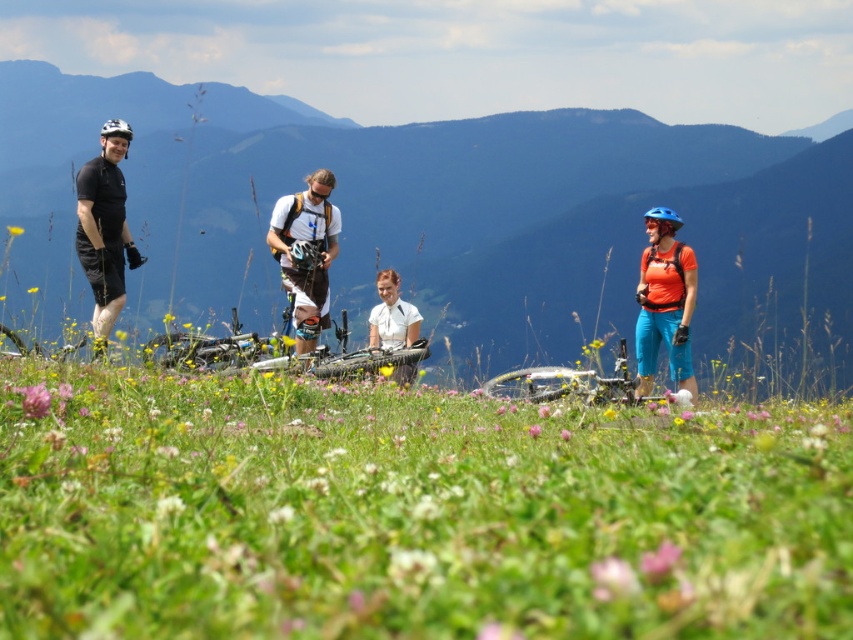
Can you confirm if black matte helmet at left is positioned below silver metallic bicycle at center?

Incorrect, black matte helmet at left is not positioned below silver metallic bicycle at center.

I want to click on black matte helmet at left, so click(103, 228).

Can you confirm if green grassy field at center is thinner than black matte helmet at left?

In fact, green grassy field at center might be wider than black matte helmet at left.

Who is more forward, (22,515) or (103,253)?

Point (22,515)

Find the location of a particular element. This screenshot has height=640, width=853. green grassy field at center is located at coordinates (409, 513).

Does black matte helmet at left have a smaller size compared to white matte t-shirt at center?

Correct, black matte helmet at left occupies less space than white matte t-shirt at center.

Does black matte helmet at left come behind white matte t-shirt at center?

No, it is not.

What do you see at coordinates (103, 228) in the screenshot? I see `black matte helmet at left` at bounding box center [103, 228].

Image resolution: width=853 pixels, height=640 pixels. Find the location of `black matte helmet at left`. black matte helmet at left is located at coordinates (103, 228).